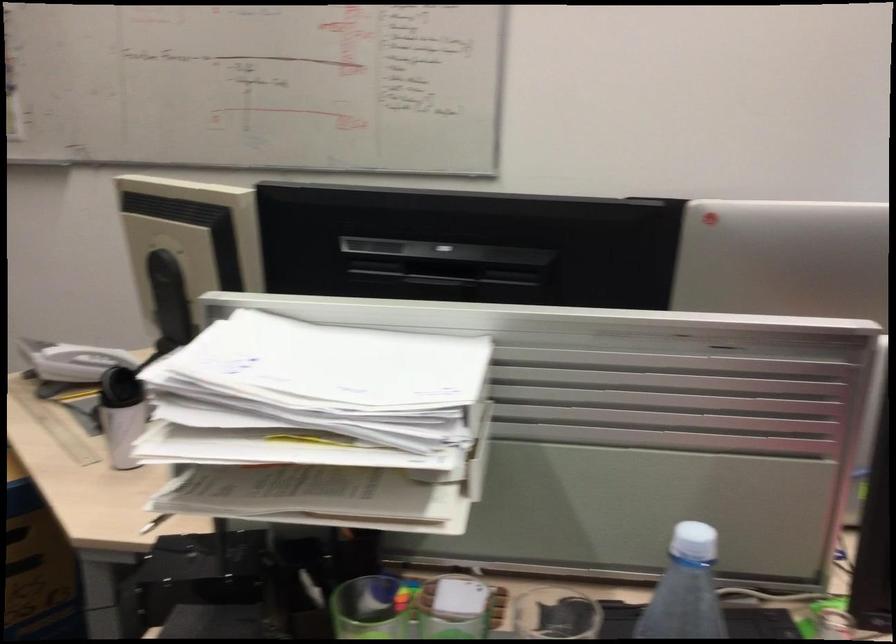
The width and height of the screenshot is (896, 644). Describe the element at coordinates (72, 361) in the screenshot. I see `the white smartphone` at that location.